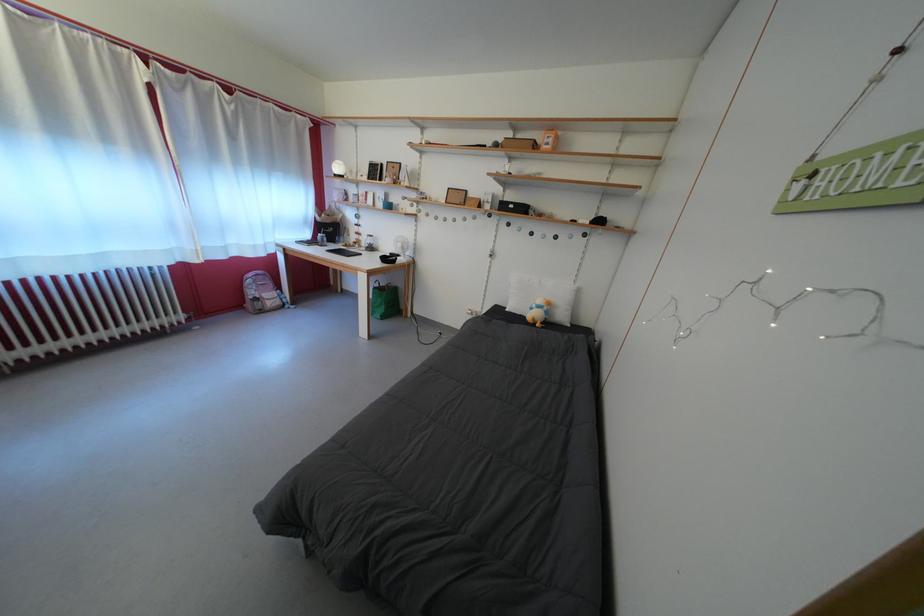
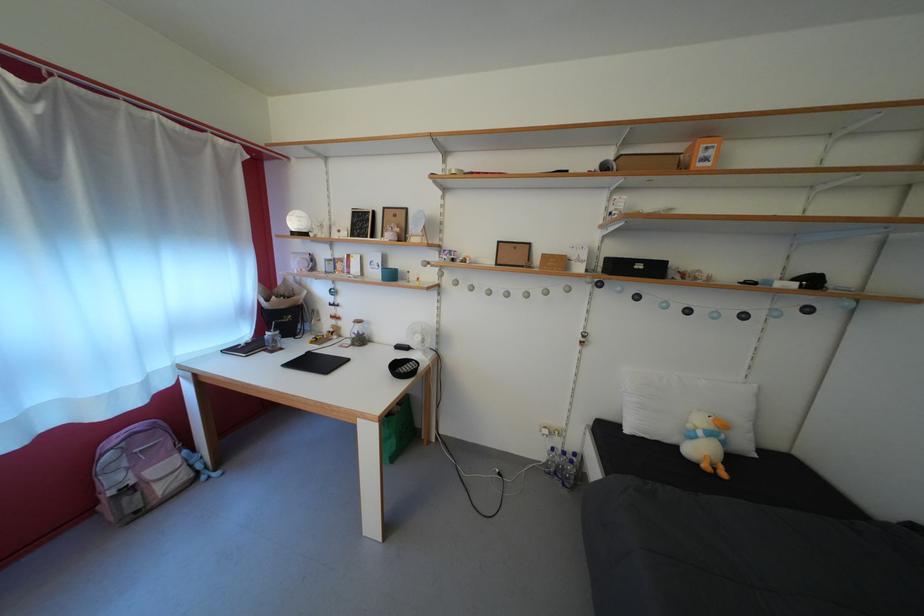
Locate, in the second image, the point that corresponds to (x=542, y=312) in the first image.

(709, 439)